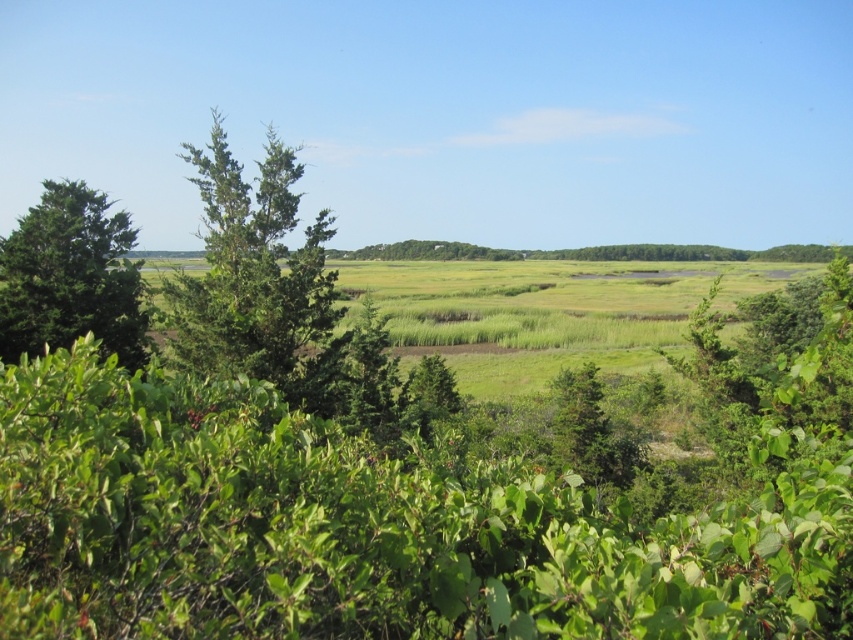
You are a bird looking for a nesting spot between the green textured tree at left and the green leafy tree at left. Which tree would provide more horizontal space for your nest?

The green textured tree at left has a larger width than the green leafy tree at left, so it would provide more horizontal space for your nest.

What is the color of the object located at point coordinates (257, 276)?

The point at coordinates (257, 276) is on a green textured tree at left, so the color is green.

You are standing at the center of the marsh and want to locate the green textured tree at left. According to the coordinates provided, in which direction should you move to find it?

The green textured tree at left is located at coordinates point (257, 276). Since you are at the center, you should move towards the left direction to find it.